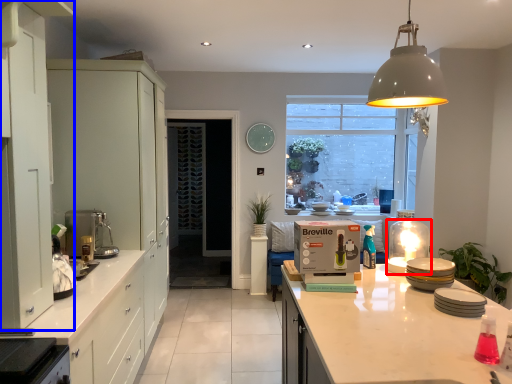
Question: Which object appears closest to the camera in this image, appliance (highlighted by a red box) or cabinetry (highlighted by a blue box)?

Choices:
 (A) appliance
 (B) cabinetry

Answer: (B)